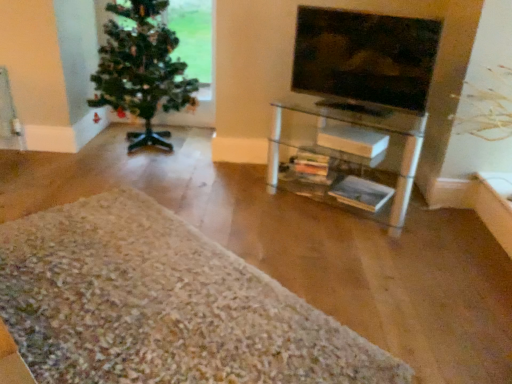
I want to click on free spot to the right of white shaggy rug at lower left, so click(381, 269).